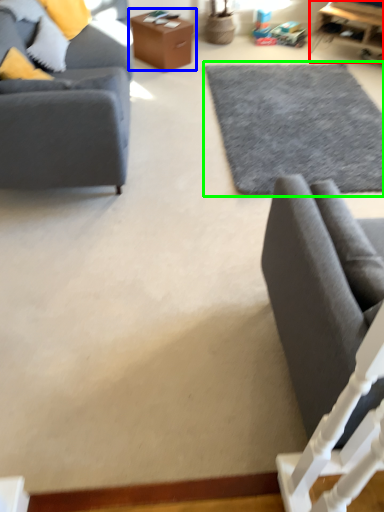
Question: Which is nearer to the table (highlighted by a red box)? table (highlighted by a blue box) or plain (highlighted by a green box).

Choices:
 (A) table
 (B) plain

Answer: (B)